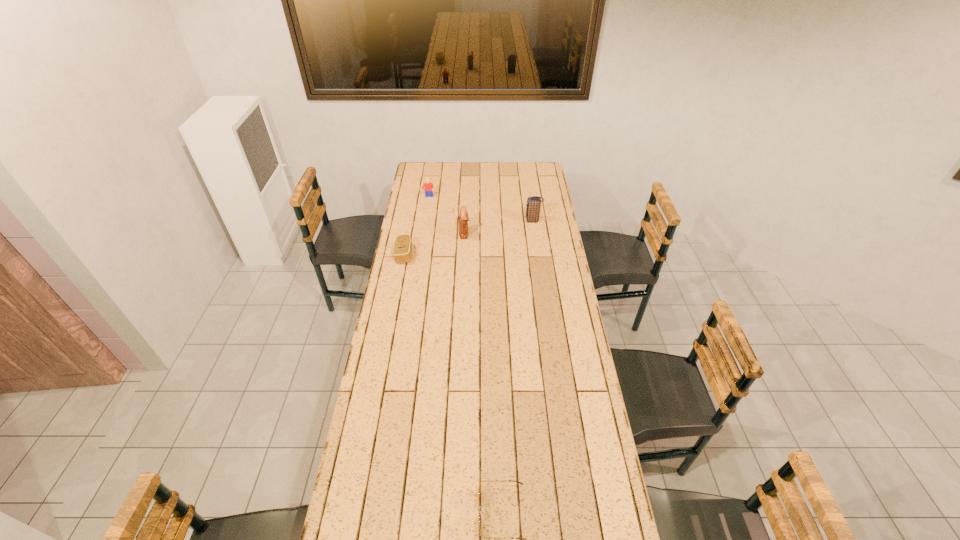
The image size is (960, 540). Find the location of `clutch bag that is the closest to the farthest clutch bag`. clutch bag that is the closest to the farthest clutch bag is located at coordinates (463, 216).

At what (x,y) coordinates should I click in order to perform the action: click on clutch bag that is the closest to the third nearest object. Please return your answer as a coordinate pair (x, y). The image size is (960, 540). Looking at the image, I should click on (402, 250).